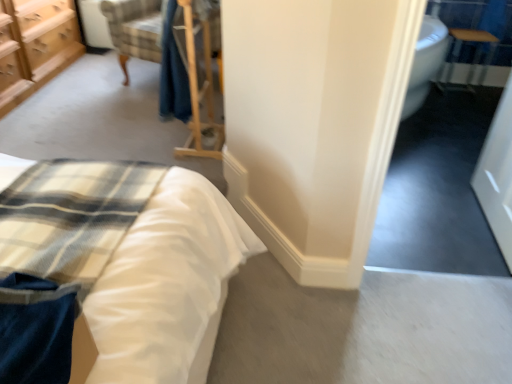
Question: From a real-world perspective, is satin white bed at lower left positioned under white glossy door at right based on gravity?

Choices:
 (A) yes
 (B) no

Answer: (A)

Question: Does satin white bed at lower left come behind white glossy door at right?

Choices:
 (A) yes
 (B) no

Answer: (B)

Question: Is satin white bed at lower left positioned before white glossy door at right?

Choices:
 (A) yes
 (B) no

Answer: (A)

Question: Is satin white bed at lower left to the left of white glossy door at right from the viewer's perspective?

Choices:
 (A) no
 (B) yes

Answer: (B)

Question: Is satin white bed at lower left outside white glossy door at right?

Choices:
 (A) yes
 (B) no

Answer: (A)

Question: Considering the relative sizes of satin white bed at lower left and white glossy door at right in the image provided, is satin white bed at lower left thinner than white glossy door at right?

Choices:
 (A) no
 (B) yes

Answer: (A)

Question: Considering the relative positions of wooden table at upper right and satin white bed at lower left in the image provided, is wooden table at upper right to the left of satin white bed at lower left from the viewer's perspective?

Choices:
 (A) yes
 (B) no

Answer: (B)

Question: Is wooden table at upper right shorter than satin white bed at lower left?

Choices:
 (A) yes
 (B) no

Answer: (A)

Question: Could you tell me if wooden table at upper right is facing satin white bed at lower left?

Choices:
 (A) yes
 (B) no

Answer: (B)

Question: Is wooden table at upper right oriented away from satin white bed at lower left?

Choices:
 (A) yes
 (B) no

Answer: (B)

Question: Is wooden table at upper right closer to camera compared to satin white bed at lower left?

Choices:
 (A) no
 (B) yes

Answer: (A)

Question: From the image's perspective, would you say wooden table at upper right is shown under satin white bed at lower left?

Choices:
 (A) yes
 (B) no

Answer: (B)

Question: Does white glossy door at right turn towards wooden chest of drawers at upper left?

Choices:
 (A) no
 (B) yes

Answer: (B)